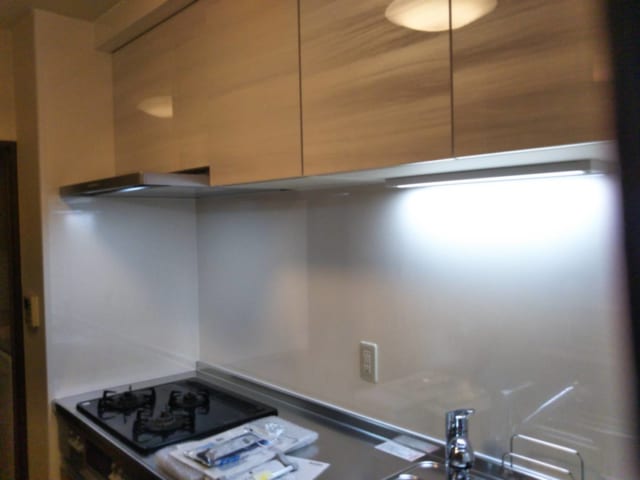
Locate an element on the screen. stovetop is located at coordinates (234, 409).